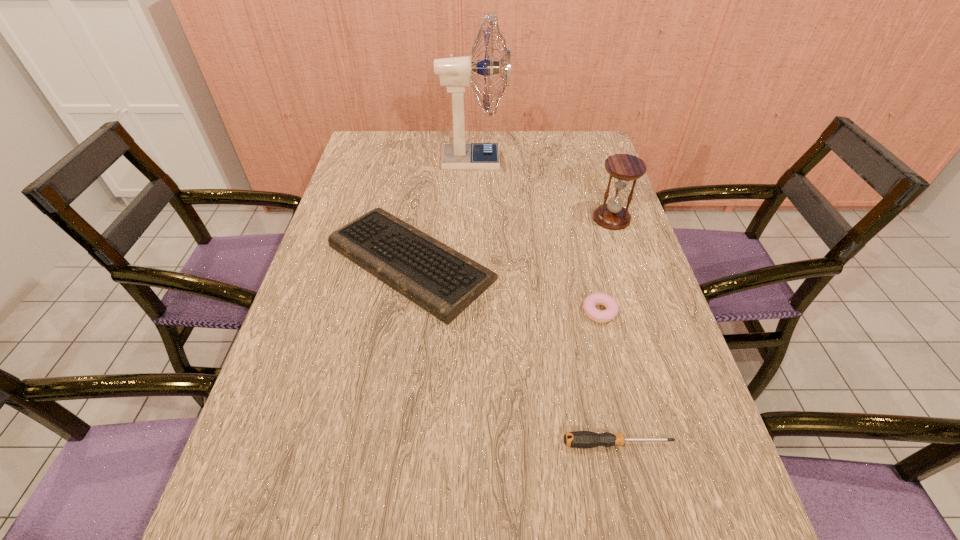
Where is `vacant region located on the left of the nearest object`? vacant region located on the left of the nearest object is located at coordinates point(488,443).

I want to click on object present at the far edge, so click(x=455, y=73).

The image size is (960, 540). What are the coordinates of `object at the left edge` in the screenshot? It's located at (444, 282).

Where is `hourglass situated at the right edge`? This screenshot has width=960, height=540. hourglass situated at the right edge is located at coordinates (623, 167).

At what (x,y) coordinates should I click in order to perform the action: click on doughnut located in the right edge section of the desktop. Please return your answer as a coordinate pair (x, y). The image size is (960, 540). Looking at the image, I should click on (612, 308).

At what (x,y) coordinates should I click in order to perform the action: click on screwdriver situated at the right edge. Please return your answer as a coordinate pair (x, y). Looking at the image, I should click on (579, 439).

Find the location of a particular element. Image resolution: width=960 pixels, height=540 pixels. vacant space at the far edge is located at coordinates (532, 164).

You are a GUI agent. You are given a task and a screenshot of the screen. Output one action in this format:
    pyautogui.click(x=<x>, y=<y>)
    Task: Click on the free point at the left edge
    
    Given the screenshot: What is the action you would take?
    pyautogui.click(x=397, y=173)

Where is `free space at the right edge`? Image resolution: width=960 pixels, height=540 pixels. free space at the right edge is located at coordinates (664, 434).

Where is `vacant space at the far left corner of the desktop`? This screenshot has height=540, width=960. vacant space at the far left corner of the desktop is located at coordinates (362, 138).